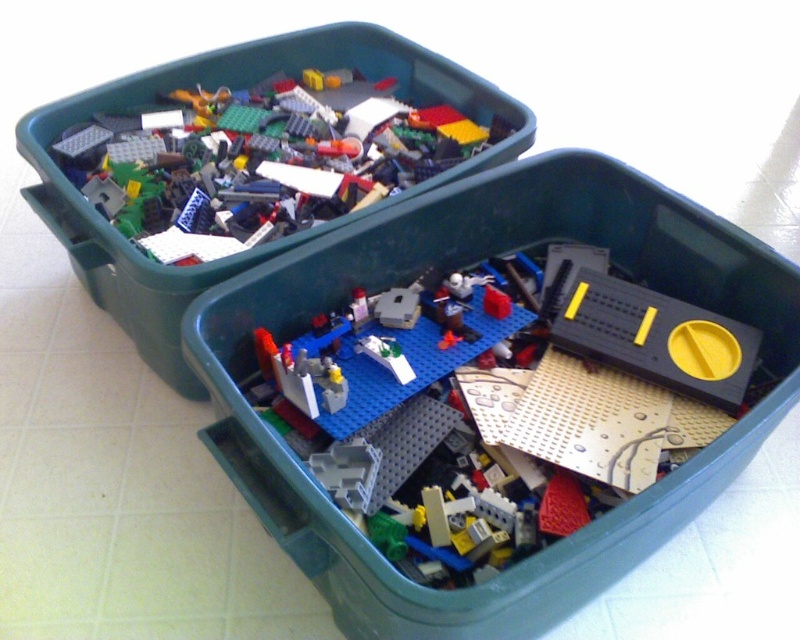
You are organizing Lego pieces in the bin and notice the translucent plastic bricks at upper left and the matte plastic lego bricks at upper left. Which one is stacked on top of the other?

The translucent plastic bricks at upper left is positioned over matte plastic lego bricks at upper left, so the translucent plastic bricks at upper left are stacked on top of the matte plastic lego bricks at upper left.

You are a toy organizer who needs to arrange the blue plastic baseplate at center and the translucent plastic bricks at upper left on a shelf. The shelf has a maximum width of 14 inches. Can you fit both items side by side without overlapping?

The distance between the blue plastic baseplate at center and the translucent plastic bricks at upper left is 15.14 inches, which exceeds the shelf width of 14 inches. Therefore, they cannot be placed side by side without overlapping.